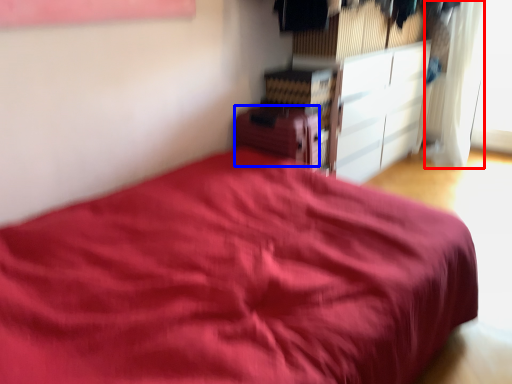
Question: Which point is further to the camera, curtain (highlighted by a red box) or cabinetry (highlighted by a blue box)?

Choices:
 (A) curtain
 (B) cabinetry

Answer: (A)